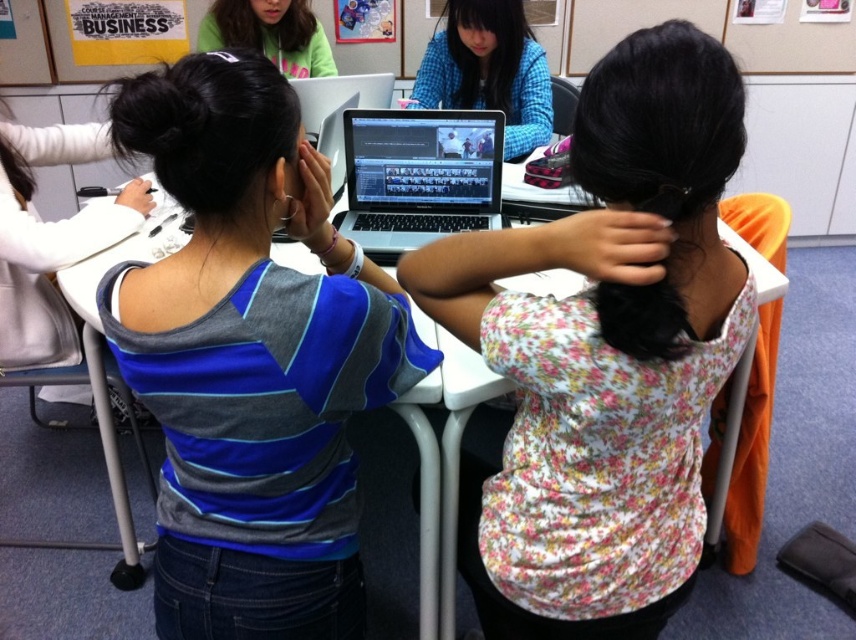
Between silver metallic laptop at center and white plastic table at center, which one appears on the right side from the viewer's perspective?

silver metallic laptop at center is more to the right.

This screenshot has height=640, width=856. I want to click on silver metallic laptop at center, so [x=419, y=177].

Is point (485, 161) more distant than point (82, 276)?

Yes.

Locate an element on the screen. silver metallic laptop at center is located at coordinates (419, 177).

Is point (201, 122) positioned behind point (223, 19)?

No.

The width and height of the screenshot is (856, 640). In order to click on blue striped shirt at center in this screenshot , I will do `click(251, 358)`.

Does point (598, 129) come farther from viewer compared to point (283, 49)?

That is False.

Is floral fabric blouse at center to the left of matte green hoodie at upper left from the viewer's perspective?

In fact, floral fabric blouse at center is to the right of matte green hoodie at upper left.

The height and width of the screenshot is (640, 856). What do you see at coordinates (605, 352) in the screenshot?
I see `floral fabric blouse at center` at bounding box center [605, 352].

This screenshot has width=856, height=640. Identify the location of floral fabric blouse at center. (605, 352).